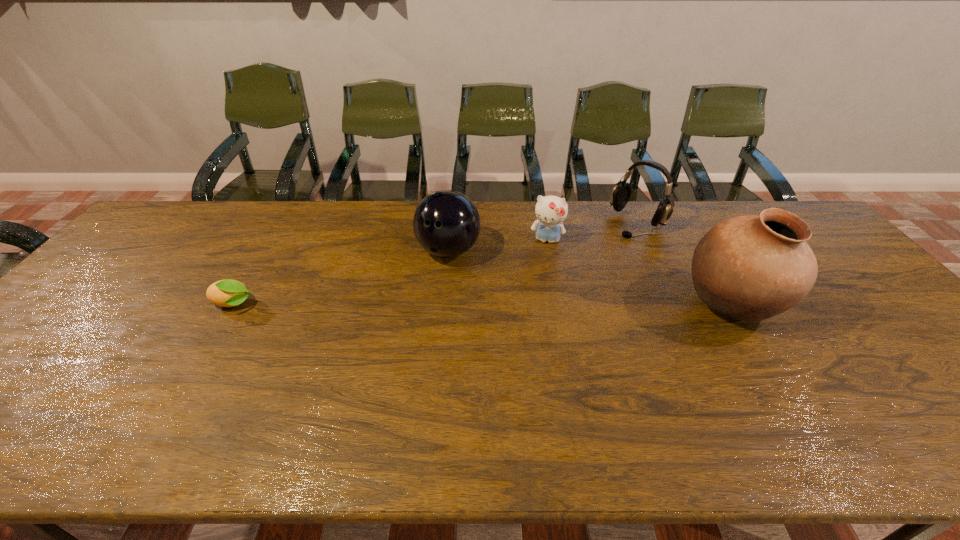
Where is `free space between the headset and the shortest object`? This screenshot has height=540, width=960. free space between the headset and the shortest object is located at coordinates (436, 264).

Where is `vacant area that lies between the third object from left to right and the headset`? This screenshot has width=960, height=540. vacant area that lies between the third object from left to right and the headset is located at coordinates (592, 231).

This screenshot has width=960, height=540. I want to click on free space between the headset and the leftmost object, so click(x=436, y=264).

Identify the location of free area in between the pottery and the headset. (684, 264).

Identify the location of empty space that is in between the bowling ball and the second shortest object. (497, 245).

Find the location of a particular element. The height and width of the screenshot is (540, 960). the third closest object to the pottery is located at coordinates (446, 223).

In order to click on object that stands as the fourth closest to the lemon in this screenshot , I will do pos(751,268).

Identify the location of vacant region that satisfies the following two spatial constraints: 1. on the back side of the bowling ball; 2. on the left side of the headset. (451, 222).

Identify the location of vacant space that satisfies the following two spatial constraints: 1. on the front side of the kitten; 2. on the left side of the tallest object. (559, 305).

Identify the location of vacant space that satisfies the following two spatial constraints: 1. on the front side of the kitten; 2. on the left side of the tallest object. (559, 305).